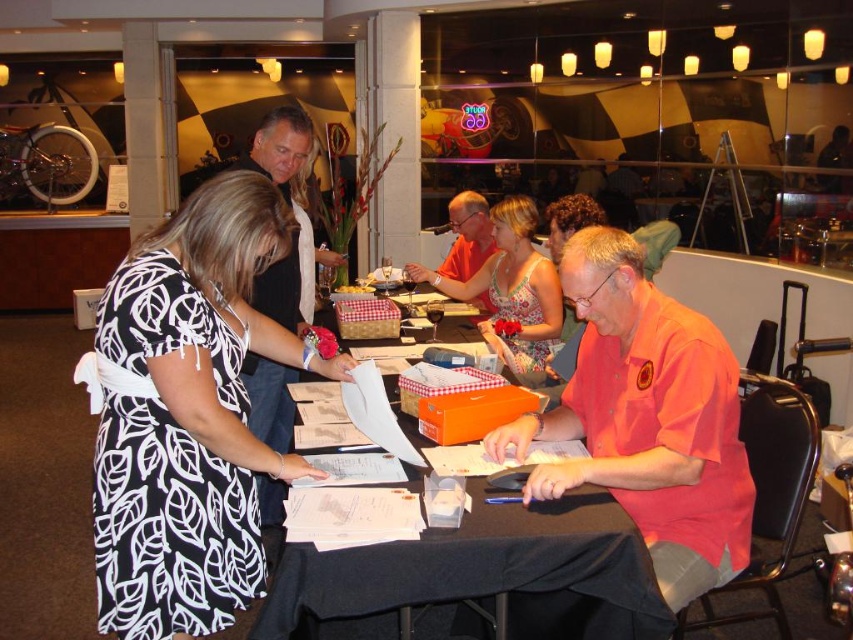
You are organizing a registration event and need to place the black paper at center and the floral dress at center on a shelf. Which item should you place first if you want to arrange them from smallest to largest?

The black paper at center should be placed first since it has a smaller size compared to the floral dress at center.

You are a photographer at this event and want to capture both the black printed dress at center and the floral dress at center in a single photo. Which dress should you focus on to ensure both are in sharp focus?

You should focus on the black printed dress at center because it is closer to the viewer, so focusing on it will keep both dresses in sharp focus due to the depth of field.

You are a photographer at the event and need to capture a clear photo of the black paper at center without the black printed dress at center blocking it. How can you adjust your position or angle to achieve this?

Since the black printed dress at center is taller than the black paper at center, you can lower your camera angle or move to a lower position to avoid the dress blocking the paper.